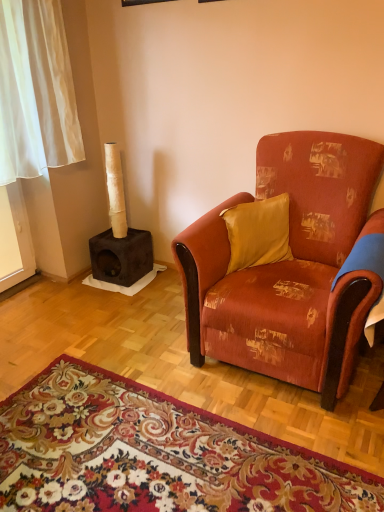
I want to click on floral carpet at lower center, so click(154, 454).

Where is `mat below the dark brown suede cat tree at left (from a real-world perspective)`? The width and height of the screenshot is (384, 512). mat below the dark brown suede cat tree at left (from a real-world perspective) is located at coordinates (x=154, y=454).

Considering the positions of objects dark brown suede cat tree at left and floral carpet at lower center in the image provided, who is more to the left, dark brown suede cat tree at left or floral carpet at lower center?

From the viewer's perspective, dark brown suede cat tree at left appears more on the left side.

How different are the orientations of dark brown suede cat tree at left and floral carpet at lower center in degrees?

They differ by 88 degrees in their facing directions.

From the image's perspective, is dark brown suede cat tree at left located above or below floral carpet at lower center?

From the image's perspective, dark brown suede cat tree at left appears above floral carpet at lower center.

Is textured orange fabric armchair at center at the right side of floral carpet at lower center?

A: Yes, textured orange fabric armchair at center is to the right of floral carpet at lower center.

From the image's perspective, relative to floral carpet at lower center, is textured orange fabric armchair at center above or below?

textured orange fabric armchair at center is above floral carpet at lower center.

Is textured orange fabric armchair at center oriented away from floral carpet at lower center?

No, textured orange fabric armchair at center's orientation is not away from floral carpet at lower center.

Consider the image. What's the angular difference between textured orange fabric armchair at center and floral carpet at lower center's facing directions?

There is a 88.8-degree angle between the facing directions of textured orange fabric armchair at center and floral carpet at lower center.

Is floral carpet at lower center aimed at satin yellow pillow at center?

No, floral carpet at lower center is not facing towards satin yellow pillow at center.

Find the location of a particular element. mat below the satin yellow pillow at center (from a real-world perspective) is located at coordinates (154, 454).

Do you think floral carpet at lower center is within satin yellow pillow at center, or outside of it?

floral carpet at lower center is spatially situated outside satin yellow pillow at center.

Can you confirm if floral carpet at lower center is thinner than satin yellow pillow at center?

No.

Which object is further away from the camera, satin yellow pillow at center or textured orange fabric armchair at center?

satin yellow pillow at center is more distant.

How many degrees apart are the facing directions of satin yellow pillow at center and textured orange fabric armchair at center?

The angular difference between satin yellow pillow at center and textured orange fabric armchair at center is 49.3 degrees.

Consider the image. Is satin yellow pillow at center positioned far away from textured orange fabric armchair at center?

No, there isn't a large distance between satin yellow pillow at center and textured orange fabric armchair at center.

Which of these two, satin yellow pillow at center or textured orange fabric armchair at center, is thinner?

With smaller width is satin yellow pillow at center.

Can you confirm if textured orange fabric armchair at center is shorter than satin yellow pillow at center?

Incorrect, the height of textured orange fabric armchair at center does not fall short of that of satin yellow pillow at center.

How many degrees apart are the facing directions of textured orange fabric armchair at center and satin yellow pillow at center?

The facing directions of textured orange fabric armchair at center and satin yellow pillow at center are 49.3 degrees apart.

Is textured orange fabric armchair at center positioned behind satin yellow pillow at center?

No, it is in front of satin yellow pillow at center.

Is textured orange fabric armchair at center at the left side of satin yellow pillow at center?

Incorrect, textured orange fabric armchair at center is not on the left side of satin yellow pillow at center.

Who is bigger, dark brown suede cat tree at left or satin yellow pillow at center?

Bigger between the two is dark brown suede cat tree at left.

Is point (115, 143) less distant than point (254, 208)?

No, (115, 143) is behind (254, 208).

Is dark brown suede cat tree at left looking in the opposite direction of satin yellow pillow at center?

No, dark brown suede cat tree at left is not facing away from satin yellow pillow at center.

This screenshot has height=512, width=384. In order to click on fireplace that is behind the satin yellow pillow at center in this screenshot , I will do `click(119, 236)`.

From the image's perspective, is satin yellow pillow at center under dark brown suede cat tree at left?

Yes.

Find the location of a particular element. fireplace behind the satin yellow pillow at center is located at coordinates (119, 236).

Would you consider satin yellow pillow at center to be distant from dark brown suede cat tree at left?

Indeed, satin yellow pillow at center is not near dark brown suede cat tree at left.

Is satin yellow pillow at center behind dark brown suede cat tree at left?

No, satin yellow pillow at center is closer to the camera.

This screenshot has height=512, width=384. Find the location of `fireplace behind the floral carpet at lower center`. fireplace behind the floral carpet at lower center is located at coordinates (119, 236).

This screenshot has width=384, height=512. I want to click on mat on the left of textured orange fabric armchair at center, so click(154, 454).

When comparing their distances from dark brown suede cat tree at left, does textured orange fabric armchair at center or satin yellow pillow at center seem closer?

satin yellow pillow at center is positioned closer to the anchor dark brown suede cat tree at left.

Considering their positions, is floral carpet at lower center positioned closer to satin yellow pillow at center than textured orange fabric armchair at center?

Based on the image, textured orange fabric armchair at center appears to be nearer to satin yellow pillow at center.

Looking at this image, looking at the image, which one is located closer to dark brown suede cat tree at left, satin yellow pillow at center or floral carpet at lower center?

The object closer to dark brown suede cat tree at left is satin yellow pillow at center.

Which object lies further to the anchor point textured orange fabric armchair at center, floral carpet at lower center or satin yellow pillow at center?

floral carpet at lower center.

Considering their positions, is dark brown suede cat tree at left positioned closer to floral carpet at lower center than textured orange fabric armchair at center?

Among the two, textured orange fabric armchair at center is located nearer to floral carpet at lower center.

Considering their positions, is satin yellow pillow at center positioned further to textured orange fabric armchair at center than dark brown suede cat tree at left?

dark brown suede cat tree at left.

Considering their positions, is dark brown suede cat tree at left positioned closer to floral carpet at lower center than satin yellow pillow at center?

satin yellow pillow at center.

Which object lies nearer to the anchor point satin yellow pillow at center, textured orange fabric armchair at center or dark brown suede cat tree at left?

textured orange fabric armchair at center lies closer to satin yellow pillow at center than the other object.

This screenshot has height=512, width=384. Identify the location of studio couch between floral carpet at lower center and dark brown suede cat tree at left from front to back. (289, 268).

Locate an element on the screen. This screenshot has height=512, width=384. studio couch positioned between floral carpet at lower center and satin yellow pillow at center from near to far is located at coordinates (289, 268).

At what (x,y) coordinates should I click in order to perform the action: click on pillow between textured orange fabric armchair at center and dark brown suede cat tree at left along the z-axis. Please return your answer as a coordinate pair (x, y). The width and height of the screenshot is (384, 512). Looking at the image, I should click on (258, 232).

At what (x,y) coordinates should I click in order to perform the action: click on pillow between floral carpet at lower center and dark brown suede cat tree at left in the front-back direction. Please return your answer as a coordinate pair (x, y). Image resolution: width=384 pixels, height=512 pixels. Looking at the image, I should click on (258, 232).